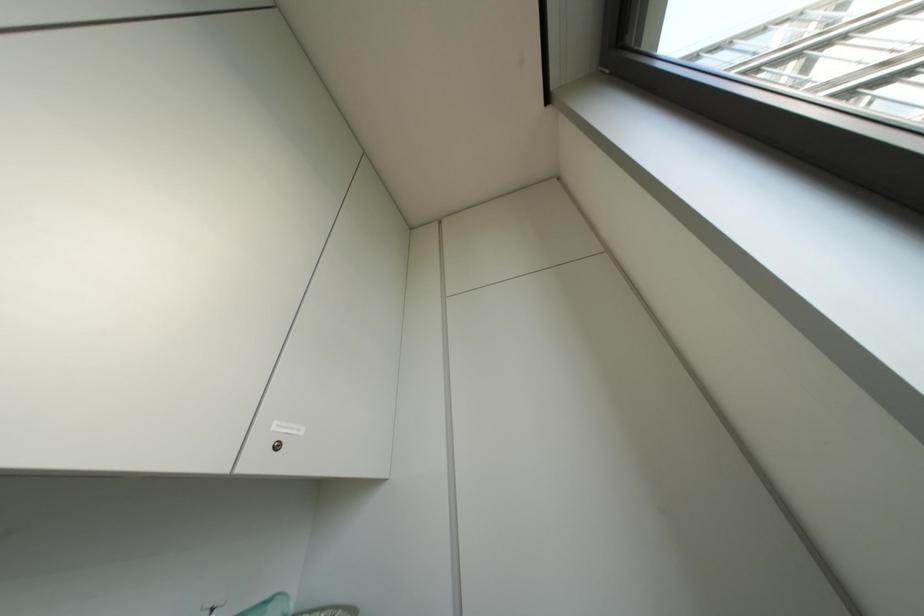
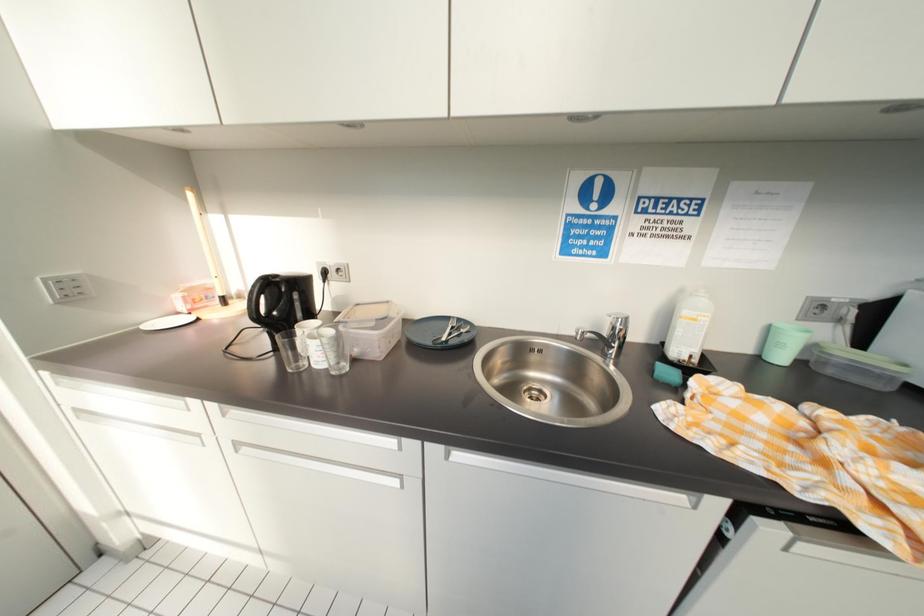
First-person continuous shooting, in which direction is the camera rotating?

The camera's rotation is toward left-down.